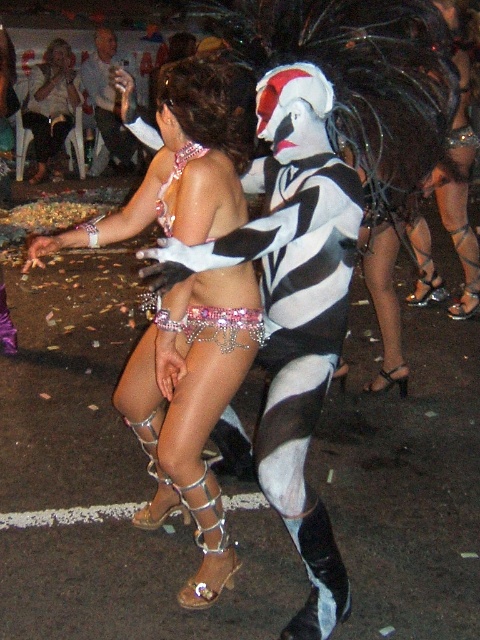
Which is above, sparkly silver bikini at center or matte white blouse at upper left?

matte white blouse at upper left

Which is behind, point (300, 236) or point (67, 84)?

The point (67, 84) is more distant.

Locate an element on the screen. sparkly silver bikini at center is located at coordinates (295, 308).

You are a GUI agent. You are given a task and a screenshot of the screen. Output one action in this format:
    pyautogui.click(x=<x>, y=<y>)
    Task: Click on the sparkly silver bikini at center
    
    Given the screenshot: What is the action you would take?
    pyautogui.click(x=295, y=308)

Does metallic silver chainmail at lower center have a greater height compared to pink sequined bikini top at center?

Incorrect, metallic silver chainmail at lower center's height is not larger of pink sequined bikini top at center's.

Does metallic silver chainmail at lower center have a larger size compared to pink sequined bikini top at center?

Incorrect, metallic silver chainmail at lower center is not larger than pink sequined bikini top at center.

The width and height of the screenshot is (480, 640). Find the location of `metallic silver chainmail at lower center`. metallic silver chainmail at lower center is located at coordinates (68, 515).

Who is more forward, (96, 49) or (231, 502)?

Positioned in front is point (231, 502).

Is light blue shirt at upper left positioned behind metallic silver chainmail at lower center?

Yes.

This screenshot has width=480, height=640. Describe the element at coordinates (108, 99) in the screenshot. I see `light blue shirt at upper left` at that location.

The width and height of the screenshot is (480, 640). Identify the location of light blue shirt at upper left. (108, 99).